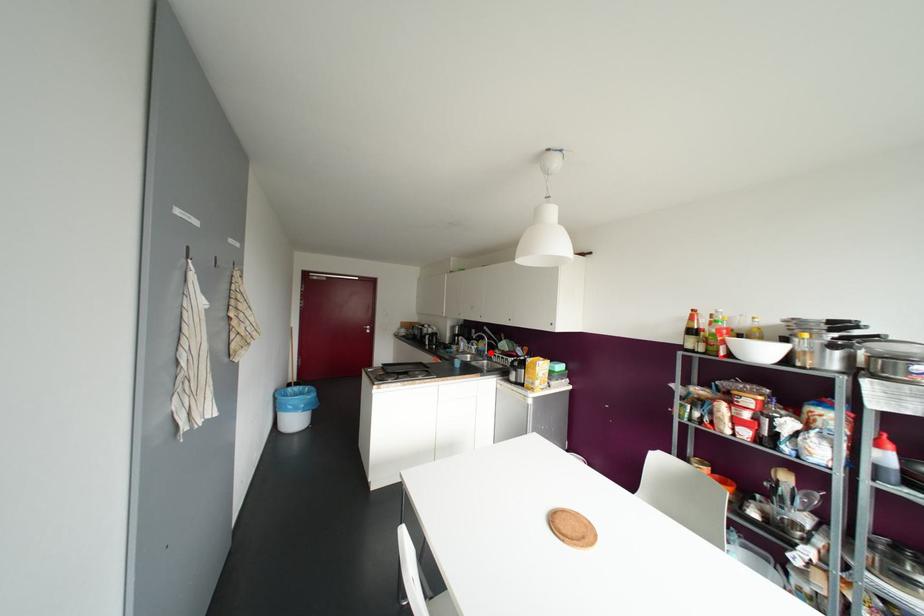
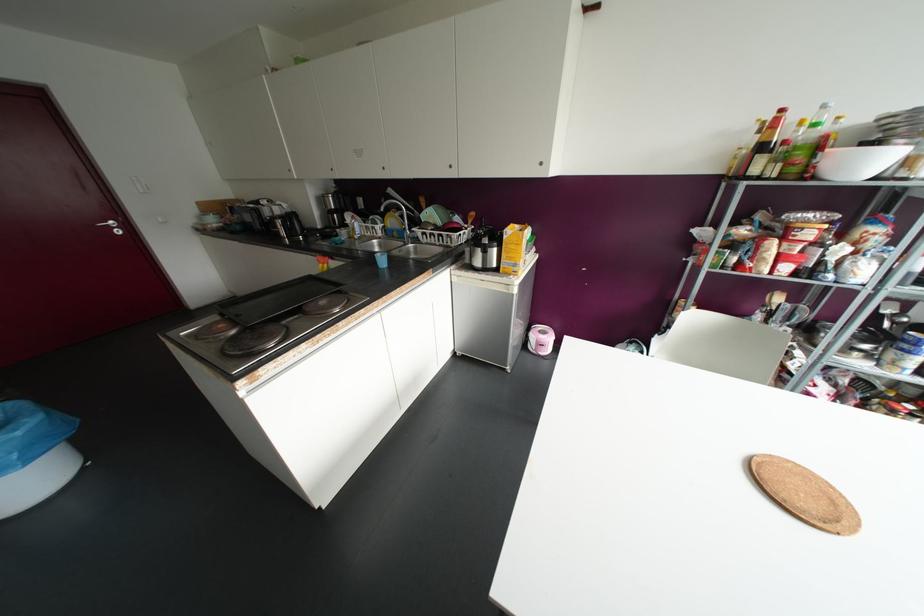
Where in the second image is the point corresponding to the highlighted location from the first image?

(417, 231)